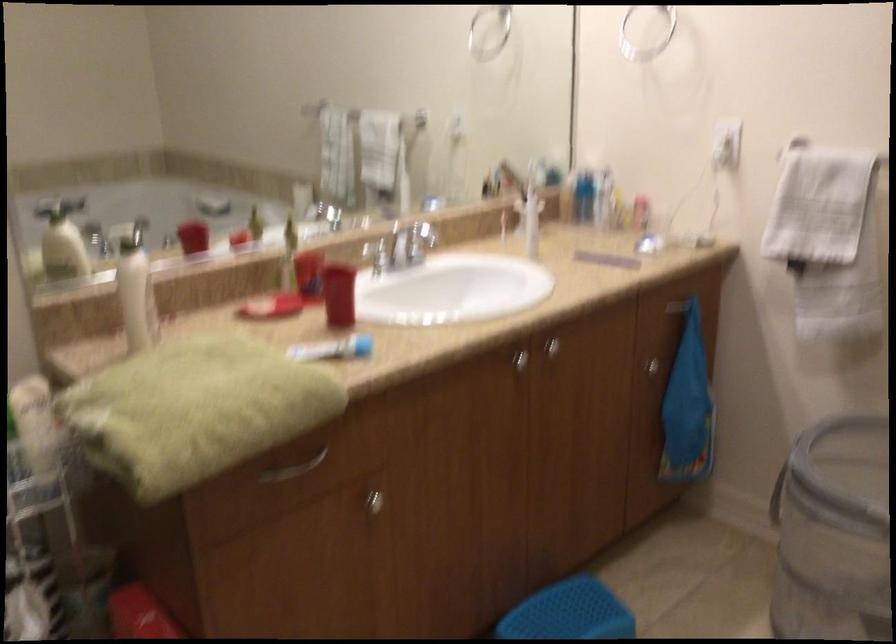
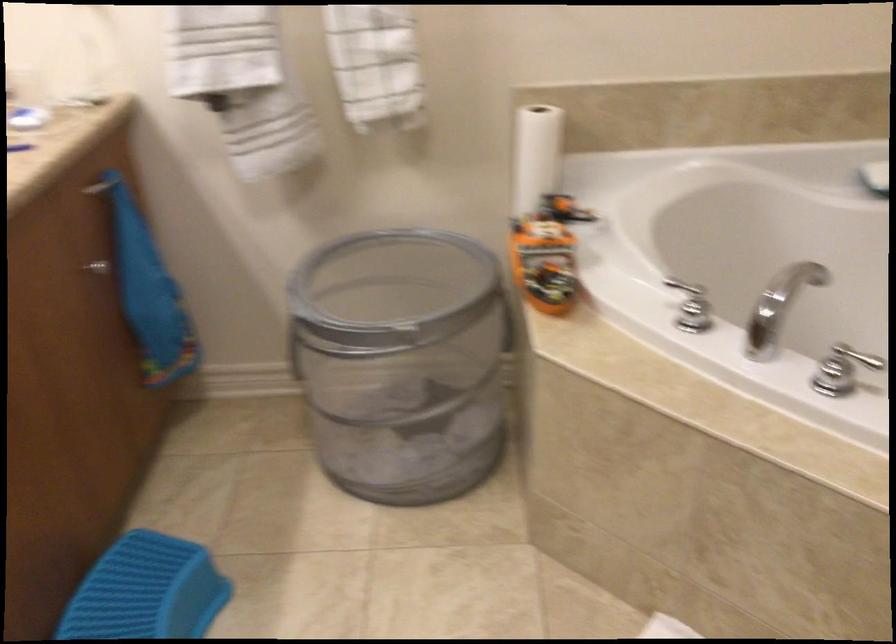
Find the pixel in the second image that matches the point at 787,486 in the first image.

(303, 341)